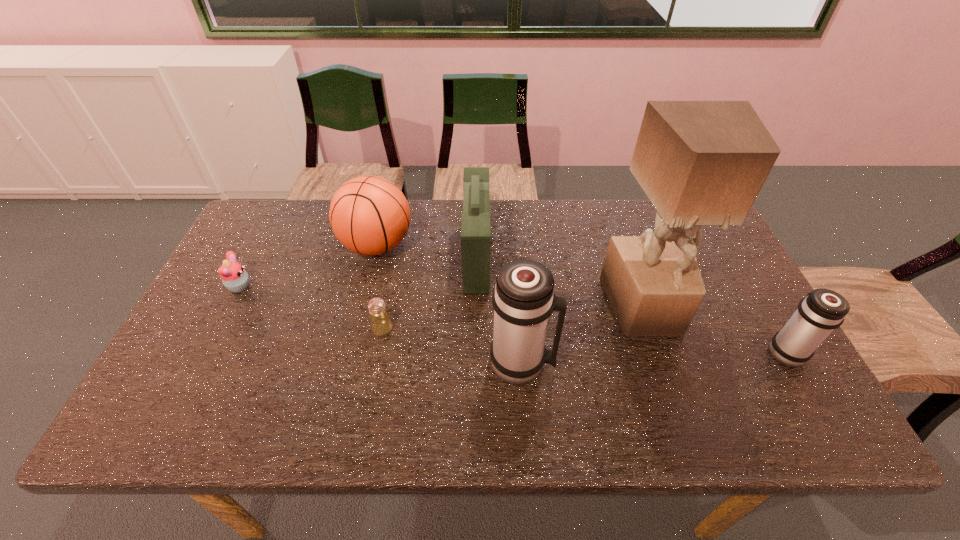
What are the coordinates of `vacant space that is in between the tallest object and the cupcake` in the screenshot? It's located at (443, 297).

Where is `free space between the tallest object and the first-aid kit`? The height and width of the screenshot is (540, 960). free space between the tallest object and the first-aid kit is located at coordinates (561, 282).

Locate an element on the screen. This screenshot has height=540, width=960. vacant space that is in between the right thermos bottle and the left thermos bottle is located at coordinates (654, 356).

Locate an element on the screen. The width and height of the screenshot is (960, 540). vacant area that lies between the saltshaker and the right thermos bottle is located at coordinates (584, 340).

Locate an element on the screen. empty space that is in between the saltshaker and the basketball is located at coordinates (380, 287).

Identify the location of the closest object to the basketball. This screenshot has height=540, width=960. click(x=475, y=221).

Identify which object is located as the sixth nearest to the basketball. Please provide its 2D coordinates. Your answer should be formatted as a tuple, i.e. [(x, y)], where the tuple contains the x and y coordinates of a point satisfying the conditions above.

[(821, 311)]

Image resolution: width=960 pixels, height=540 pixels. What are the coordinates of `vacant position in the image that satisfies the following two spatial constraints: 1. on the front-facing side of the first-aid kit; 2. on the side with the handle of the shorter thermos bottle` in the screenshot? It's located at (476, 350).

At what (x,y) coordinates should I click in order to perform the action: click on free space that satisfies the following two spatial constraints: 1. on the front side of the basketball; 2. on the face of the cupcake. Please return your answer as a coordinate pair (x, y). The width and height of the screenshot is (960, 540). Looking at the image, I should click on (367, 287).

What are the coordinates of `free space that satisfies the following two spatial constraints: 1. on the back side of the saltshaker; 2. on the face of the leftmost object` in the screenshot? It's located at 391,287.